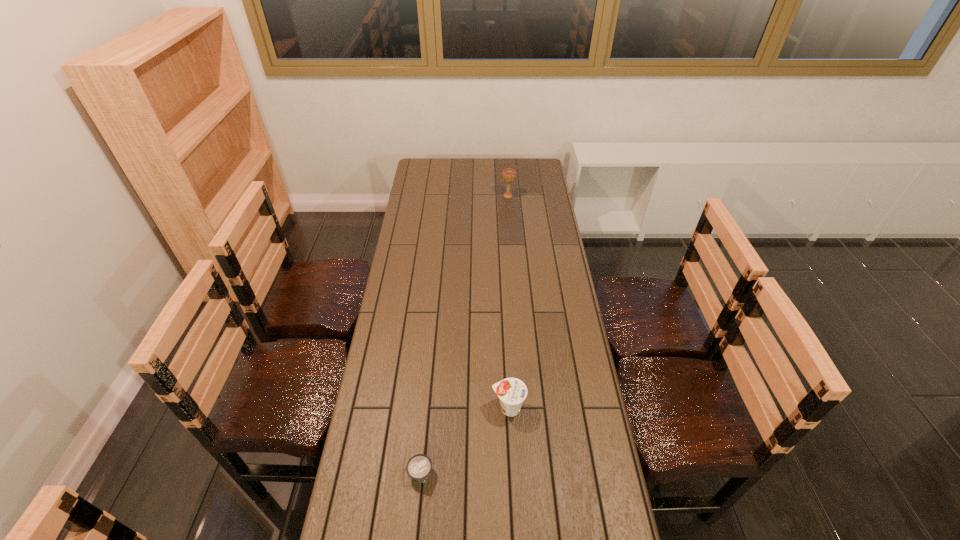
Locate an element on the screen. This screenshot has width=960, height=540. the farthest object is located at coordinates (508, 175).

I want to click on chalice, so click(x=508, y=175).

I want to click on the right yogurt, so click(512, 392).

Where is `the taller yogurt`? This screenshot has height=540, width=960. the taller yogurt is located at coordinates (512, 392).

The width and height of the screenshot is (960, 540). Identify the location of the nearest object. (419, 467).

At what (x,y) coordinates should I click in order to perform the action: click on the shortest object. Please return your answer as a coordinate pair (x, y). Looking at the image, I should click on (419, 467).

The width and height of the screenshot is (960, 540). Find the location of `blank area located on the back of the chalice`. blank area located on the back of the chalice is located at coordinates (506, 176).

Image resolution: width=960 pixels, height=540 pixels. I want to click on vacant area situated 0.400m on the left of the second tallest object, so click(x=367, y=408).

Identify the location of vacant point located 0.180m on the back of the shorter yogurt. (427, 405).

Identify the location of object situated at the left edge. (419, 467).